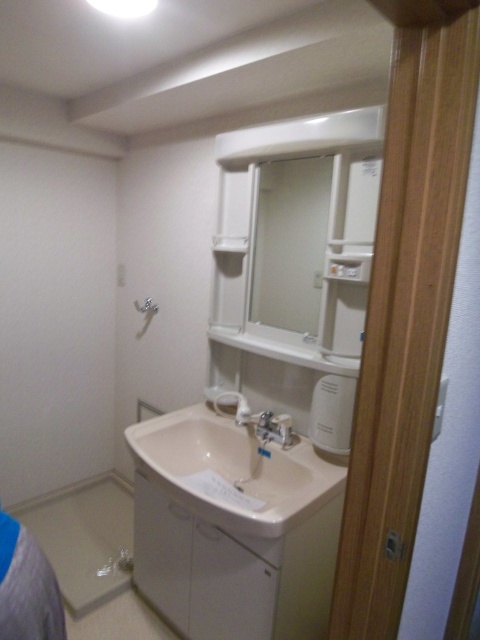
Where is `white glossy sink at center`? white glossy sink at center is located at coordinates (232, 470).

Which is in front, point (288, 484) or point (137, 300)?

Positioned in front is point (288, 484).

Identify the location of white glossy sink at center. (232, 470).

Can you confirm if satin nickel faucet at sink center is smaller than matte white shower at upper center?

Actually, satin nickel faucet at sink center might be larger than matte white shower at upper center.

This screenshot has height=640, width=480. What do you see at coordinates (275, 428) in the screenshot? I see `satin nickel faucet at sink center` at bounding box center [275, 428].

The width and height of the screenshot is (480, 640). What are the coordinates of `satin nickel faucet at sink center` in the screenshot? It's located at (275, 428).

Consider the image. Is white glossy sink at center behind satin nickel faucet at sink center?

No, white glossy sink at center is in front of satin nickel faucet at sink center.

Who is positioned more to the right, white glossy sink at center or satin nickel faucet at sink center?

From the viewer's perspective, satin nickel faucet at sink center appears more on the right side.

Is point (133, 433) closer to camera compared to point (268, 417)?

No, it is behind (268, 417).

Locate an element on the screen. The image size is (480, 640). white glossy sink at center is located at coordinates (232, 470).